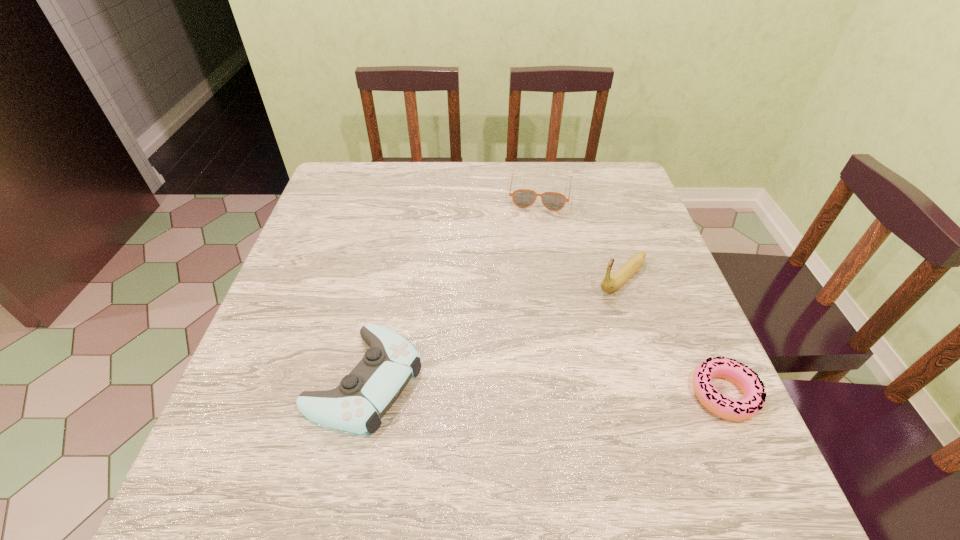
Identify the location of free space located at the stem of the second farthest object. (509, 381).

Locate an element on the screen. Image resolution: width=960 pixels, height=540 pixels. vacant area situated 0.100m at the stem of the second farthest object is located at coordinates (579, 318).

Identify the location of vacant space located 0.180m at the stem of the second farthest object. This screenshot has height=540, width=960. (556, 339).

Locate an element on the screen. This screenshot has width=960, height=540. object present at the far edge is located at coordinates (523, 198).

Locate an element on the screen. control located in the near edge section of the desktop is located at coordinates (356, 405).

Find the location of a particular element. This screenshot has width=960, height=540. doughnut that is at the near edge is located at coordinates (745, 378).

I want to click on object positioned at the left edge, so [x=356, y=405].

The image size is (960, 540). In order to click on doughnut that is at the right edge in this screenshot , I will do `click(745, 378)`.

In order to click on banana located at the right edge in this screenshot , I will do `click(609, 284)`.

Locate an element on the screen. The width and height of the screenshot is (960, 540). object at the near left corner is located at coordinates (356, 405).